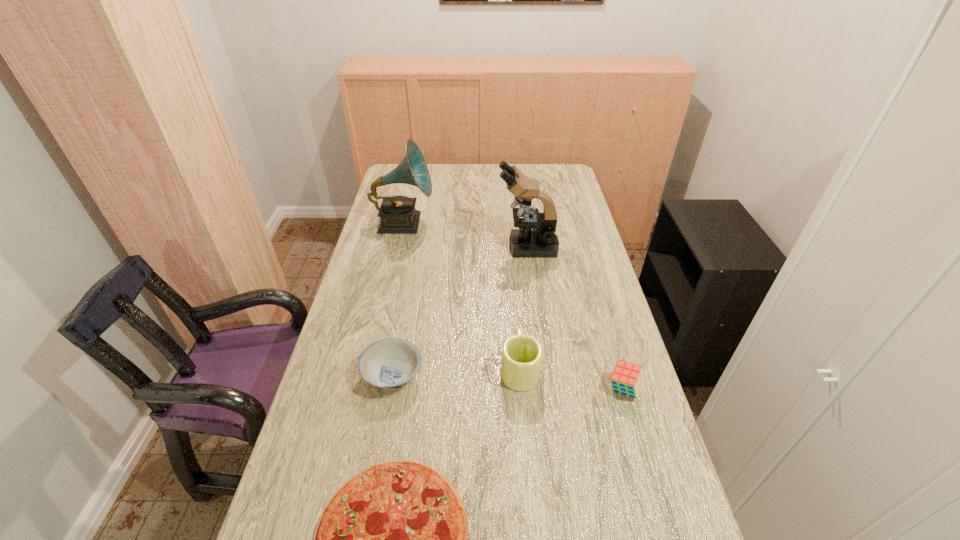
Find the location of a particular element. phonograph_record is located at coordinates (397, 213).

Find the location of a particular element. The width and height of the screenshot is (960, 540). microscope is located at coordinates (536, 237).

I want to click on the fourth shortest object, so click(521, 361).

Find the location of a particular element. This screenshot has height=540, width=960. the fourth tallest object is located at coordinates (627, 378).

At what (x,y) coordinates should I click in order to perform the action: click on cube. Please return your answer as a coordinate pair (x, y). Looking at the image, I should click on (627, 378).

Where is `bowl`? This screenshot has width=960, height=540. bowl is located at coordinates (389, 364).

At what (x,y) coordinates should I click in order to perform the action: click on free spot located from the horn of the phonograph_record. Please return your answer as a coordinate pair (x, y). Looking at the image, I should click on (480, 223).

Image resolution: width=960 pixels, height=540 pixels. In order to click on vacant region located on the back of the microscope in this screenshot , I will do `click(518, 183)`.

Where is `vacant region located with the handle on the side of the mug`? This screenshot has height=540, width=960. vacant region located with the handle on the side of the mug is located at coordinates (516, 314).

Where is `vacant space located 0.190m with the handle on the side of the mug`? The height and width of the screenshot is (540, 960). vacant space located 0.190m with the handle on the side of the mug is located at coordinates (514, 301).